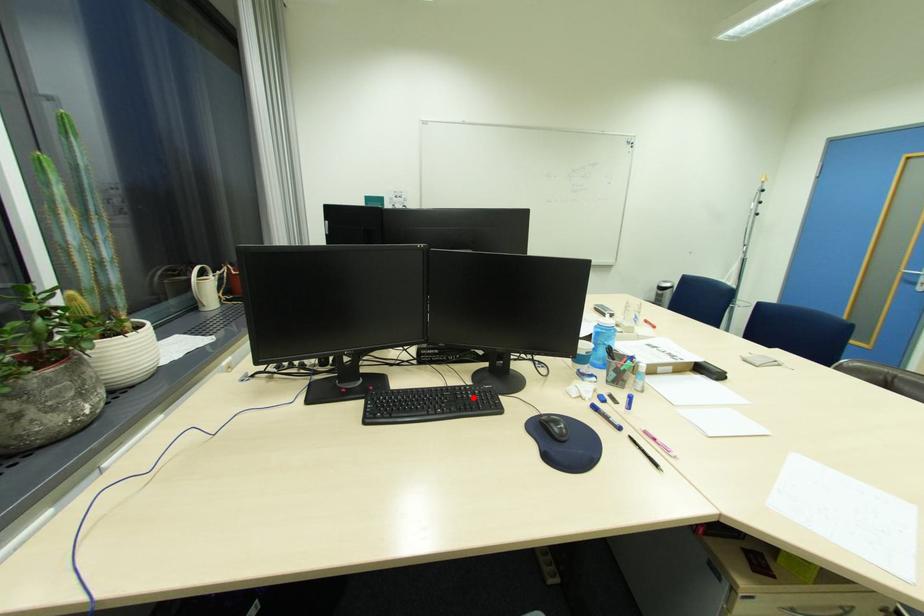
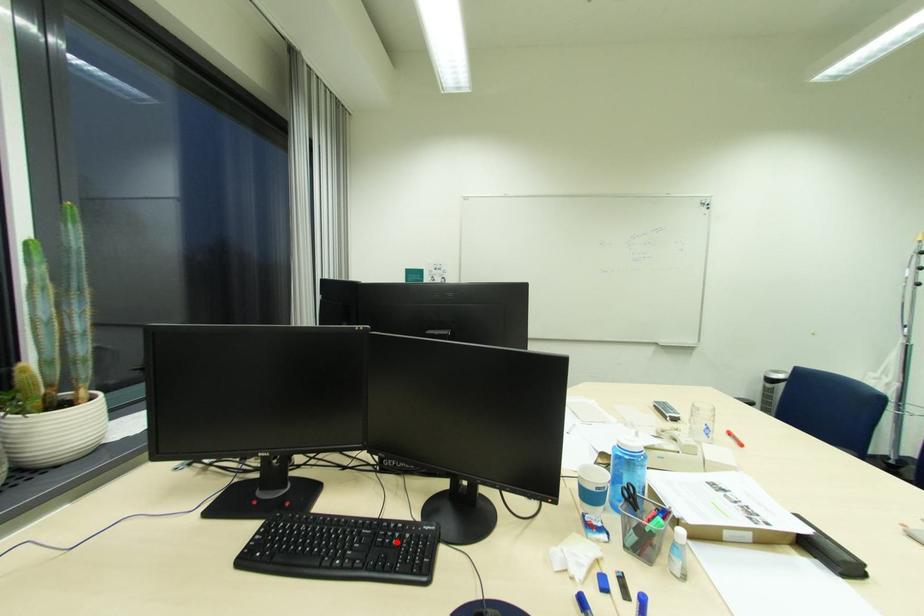
I am providing you with two images of the same scene from different viewpoints. A red point is marked on the first image and another point is marked on the second image. Are the points marked in image1 and image2 representing the same 3D position?

Yes